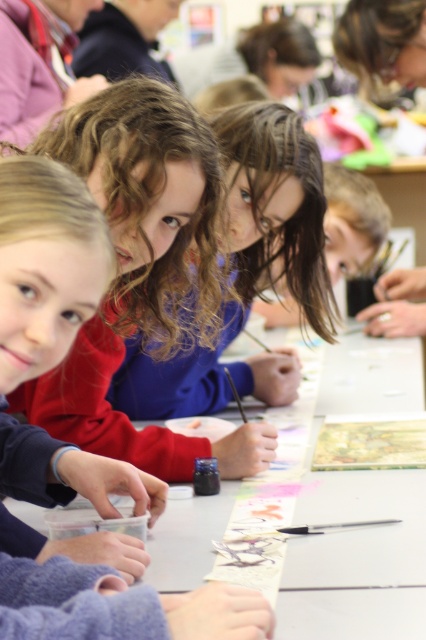
Does matte red sweater at center appear over white paper at center?

Yes, matte red sweater at center is above white paper at center.

Where is `matte red sweater at center`? The width and height of the screenshot is (426, 640). matte red sweater at center is located at coordinates (141, 273).

Does white paper at center have a larger size compared to blue fabric shirt at center?

Indeed, white paper at center has a larger size compared to blue fabric shirt at center.

Does white paper at center appear over blue fabric shirt at center?

No.

Where is `white paper at center`? The width and height of the screenshot is (426, 640). white paper at center is located at coordinates point(356,556).

Is matte red sweater at center thinner than blue fabric shirt at center?

Correct, matte red sweater at center's width is less than blue fabric shirt at center's.

Consider the image. Is matte red sweater at center smaller than blue fabric shirt at center?

Actually, matte red sweater at center might be larger than blue fabric shirt at center.

You are a GUI agent. You are given a task and a screenshot of the screen. Output one action in this format:
    pyautogui.click(x=<x>, y=<y>)
    Task: Click on the matte red sweater at center
    The width and height of the screenshot is (426, 640).
    Given the screenshot: What is the action you would take?
    pyautogui.click(x=141, y=273)

You are a GUI agent. You are given a task and a screenshot of the screen. Output one action in this format:
    pyautogui.click(x=<x>, y=<y>)
    Task: Click on the matte red sweater at center
    The width and height of the screenshot is (426, 640).
    Given the screenshot: What is the action you would take?
    (141, 273)